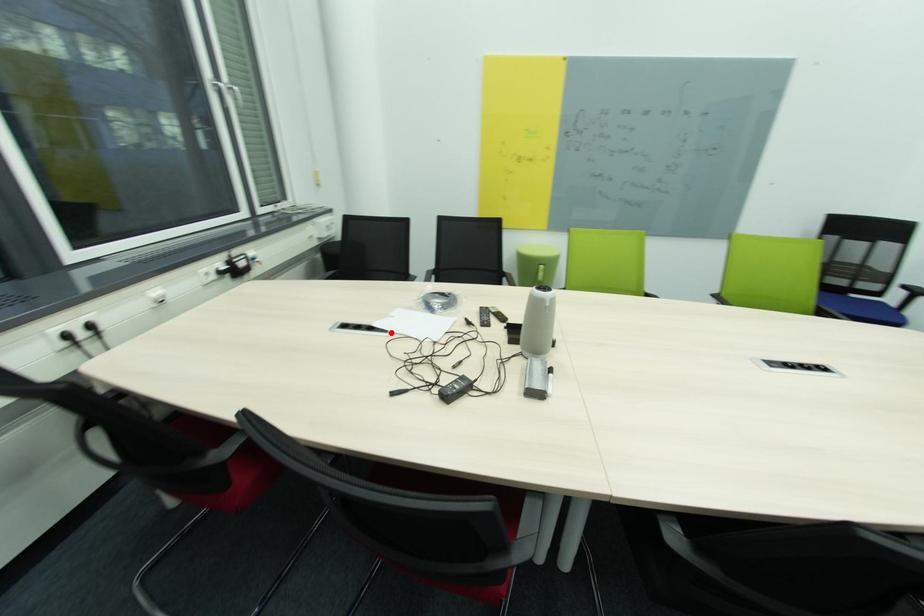
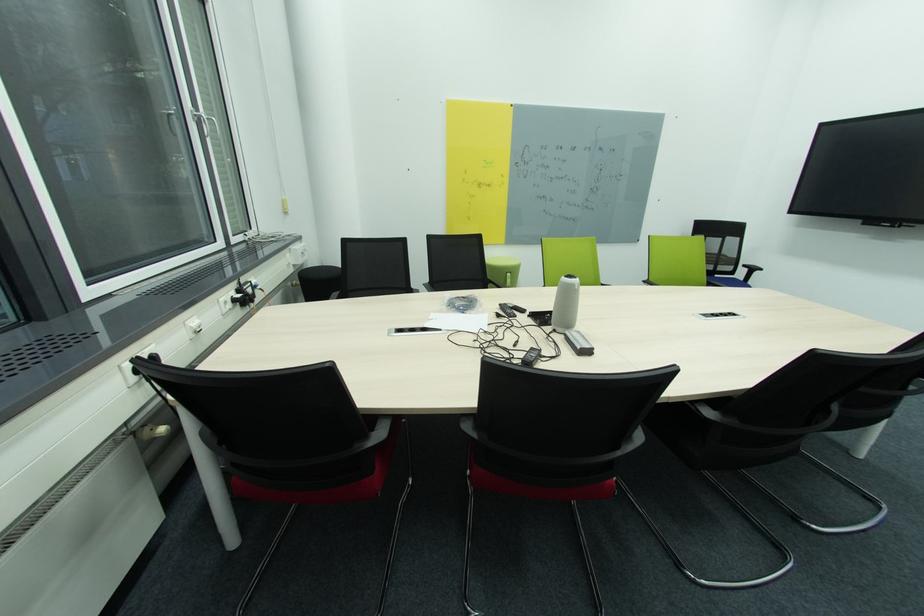
In the second image, find the point that corresponds to the highlighted location in the first image.

(444, 331)